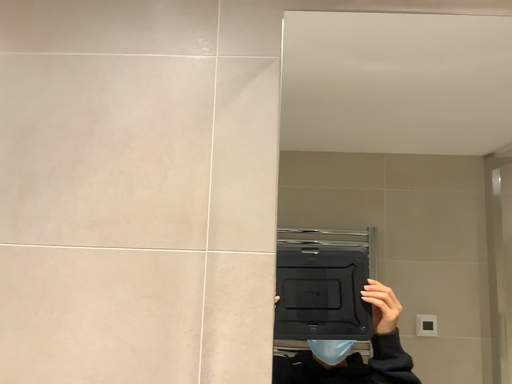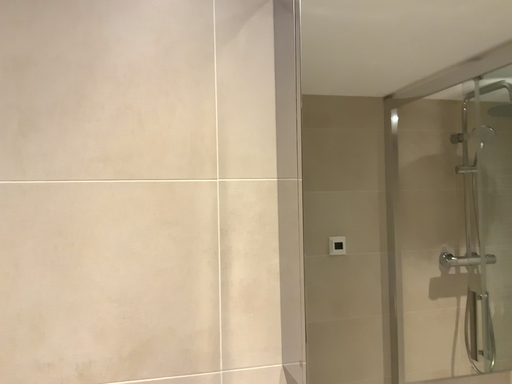
Question: Which way did the camera rotate in the video?

Choices:
 (A) rotated downward
 (B) rotated upward

Answer: (A)